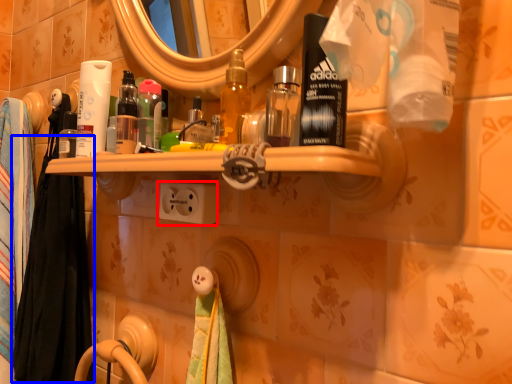
Question: Which point is further to the camera, electric outlet (highlighted by a red box) or bath towel (highlighted by a blue box)?

Choices:
 (A) electric outlet
 (B) bath towel

Answer: (B)